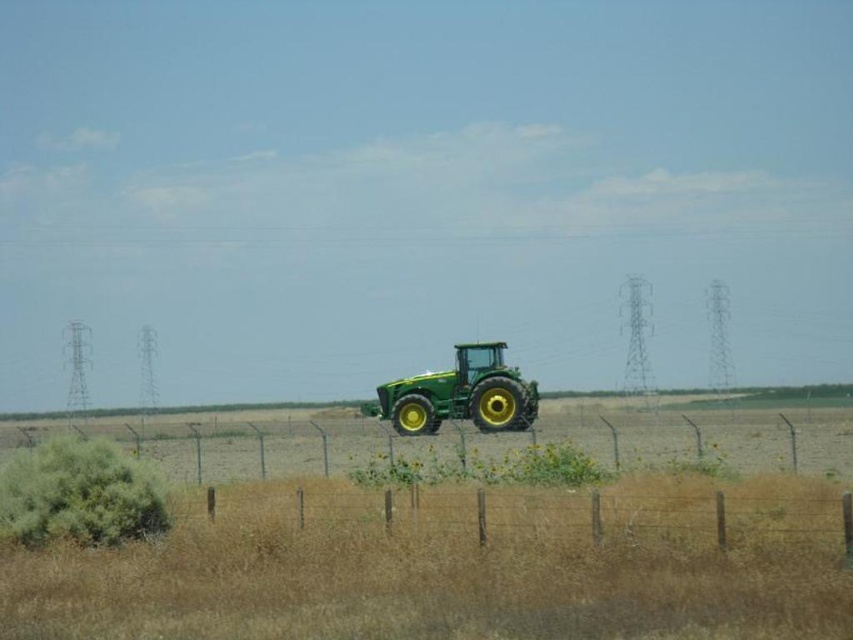
Looking at this image, you are standing at the origin point of the image. You want to walk to the brown dry grass at lower center. What are the coordinates you need to move to?

The coordinates to reach the brown dry grass at lower center are point (x=447, y=572).